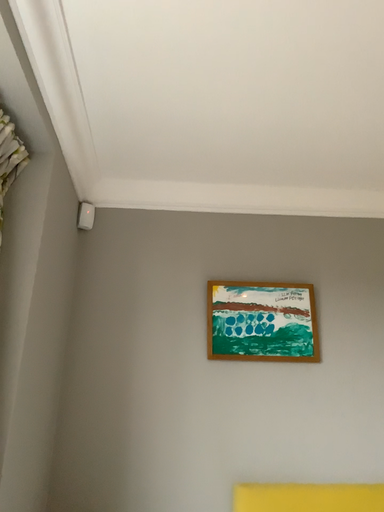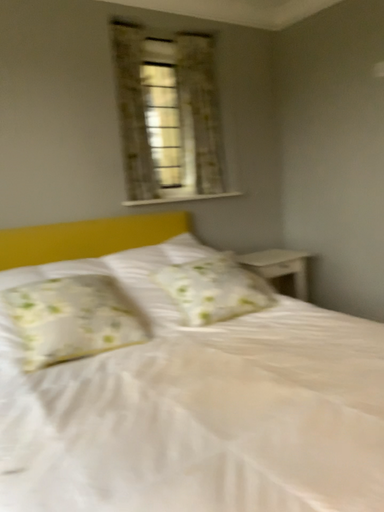
Question: Which way did the camera rotate in the video?

Choices:
 (A) rotated upward
 (B) rotated downward

Answer: (B)